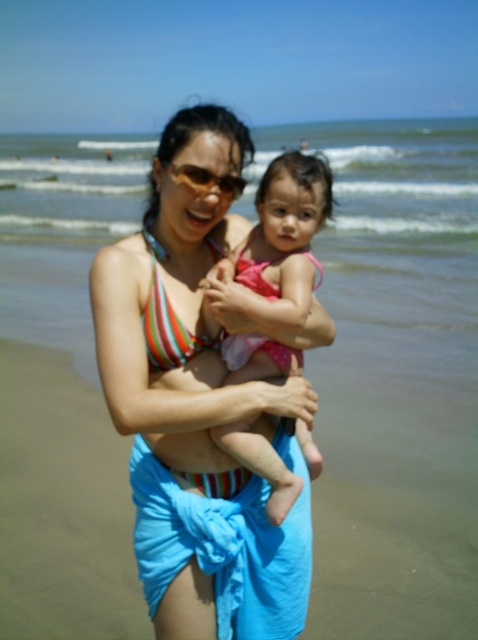
Question: Which point is farther to the camera?

Choices:
 (A) striped bikini top at center
 (B) pink fabric at center

Answer: (B)

Question: Is striped bikini top at center positioned in front of pink fabric at center?

Choices:
 (A) no
 (B) yes

Answer: (B)

Question: Is striped bikini top at center positioned at the back of pink fabric at center?

Choices:
 (A) yes
 (B) no

Answer: (B)

Question: Among these objects, which one is farthest from the camera?

Choices:
 (A) pink fabric at center
 (B) striped bikini top at center

Answer: (A)

Question: Observing the image, what is the correct spatial positioning of striped bikini top at center in reference to pink fabric at center?

Choices:
 (A) right
 (B) left

Answer: (B)